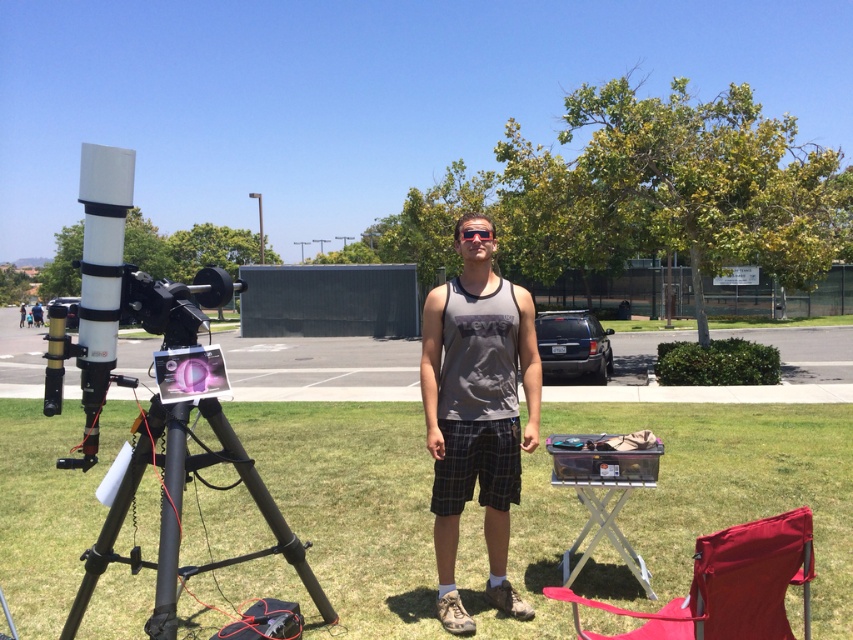
Question: Is green grass at lower center closer to the viewer compared to gray fabric tank top at center?

Choices:
 (A) no
 (B) yes

Answer: (A)

Question: Among these objects, which one is nearest to the camera?

Choices:
 (A) gray fabric tank top at center
 (B) matte black goggles at center
 (C) black matte tripod at lower left
 (D) white plastic telescope at left

Answer: (C)

Question: From the image, what is the correct spatial relationship of gray fabric tank top at center in relation to black matte tripod at lower left?

Choices:
 (A) below
 (B) above

Answer: (B)

Question: Among these objects, which one is nearest to the camera?

Choices:
 (A) green grass at lower center
 (B) black matte tripod at lower left
 (C) white plastic telescope at left
 (D) matte black goggles at center

Answer: (B)

Question: Can you confirm if green grass at lower center is bigger than black matte tripod at lower left?

Choices:
 (A) no
 (B) yes

Answer: (B)

Question: Which of the following is the closest to the observer?

Choices:
 (A) white plastic telescope at left
 (B) matte black goggles at center

Answer: (A)